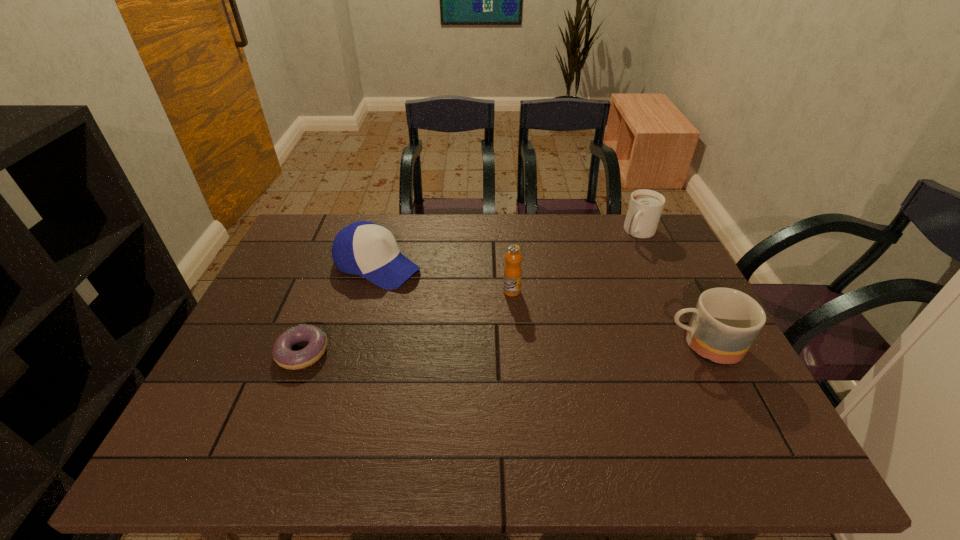
Where is `doughnut`? Image resolution: width=960 pixels, height=540 pixels. doughnut is located at coordinates (283, 355).

The width and height of the screenshot is (960, 540). What are the coordinates of `mug` in the screenshot? It's located at (725, 322).

Where is `cappuccino`? Image resolution: width=960 pixels, height=540 pixels. cappuccino is located at coordinates (645, 207).

Locate an element on the screen. This screenshot has width=960, height=540. baseball cap is located at coordinates (363, 248).

You are a GUI agent. You are given a task and a screenshot of the screen. Output one action in this format:
    pyautogui.click(x=<x>, y=<y>)
    Task: Click on the orange juice
    This screenshot has height=540, width=960.
    Given the screenshot: What is the action you would take?
    pyautogui.click(x=512, y=272)

You are a GUI agent. You are given a task and a screenshot of the screen. Output one action in this format:
    pyautogui.click(x=<x>, y=<y>)
    Task: Click on the free space located on the back of the doughnut
    The image size is (960, 540).
    Given the screenshot: What is the action you would take?
    pyautogui.click(x=331, y=278)

Where is `vacant space located 0.160m on the side with the handle of the mug`? Image resolution: width=960 pixels, height=540 pixels. vacant space located 0.160m on the side with the handle of the mug is located at coordinates (601, 345).

Image resolution: width=960 pixels, height=540 pixels. I want to click on free space located 0.370m on the side with the handle of the mug, so click(x=518, y=345).

At what (x,y) coordinates should I click in order to perform the action: click on vacant space located on the side with the handle of the mug. Please return your answer as a coordinate pair (x, y). This screenshot has height=540, width=960. Looking at the image, I should click on (554, 345).

Image resolution: width=960 pixels, height=540 pixels. What are the coordinates of `vacant space located on the side with the handle of the cappuccino` in the screenshot? It's located at (615, 270).